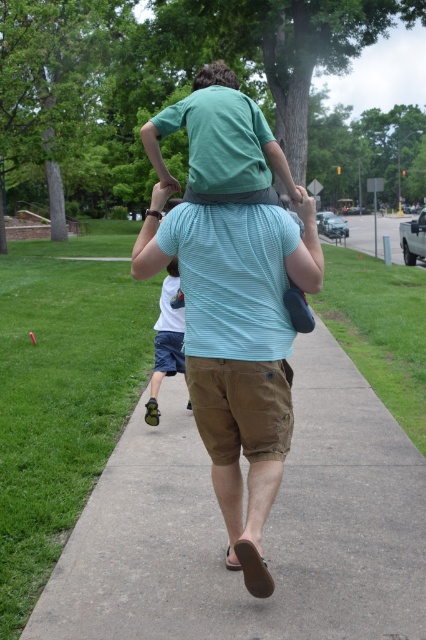
Question: Among these points, which one is nearest to the camera?

Choices:
 (A) (262, 608)
 (B) (310, 266)
 (C) (166, 276)
 (D) (236, 198)

Answer: (D)

Question: Can you confirm if concrete at center is bigger than dark brown hair at upper center?

Choices:
 (A) no
 (B) yes

Answer: (A)

Question: Does concrete at center have a larger size compared to light blue shorts at center?

Choices:
 (A) no
 (B) yes

Answer: (A)

Question: Among these objects, which one is farthest from the camera?

Choices:
 (A) concrete at center
 (B) matte green shirt at center

Answer: (B)

Question: Based on their relative distances, which object is nearer to the light blue striped shirt at center?

Choices:
 (A) light blue shorts at center
 (B) dark brown hair at upper center

Answer: (A)

Question: Can you confirm if concrete at center is positioned above matte green shirt at center?

Choices:
 (A) no
 (B) yes

Answer: (A)